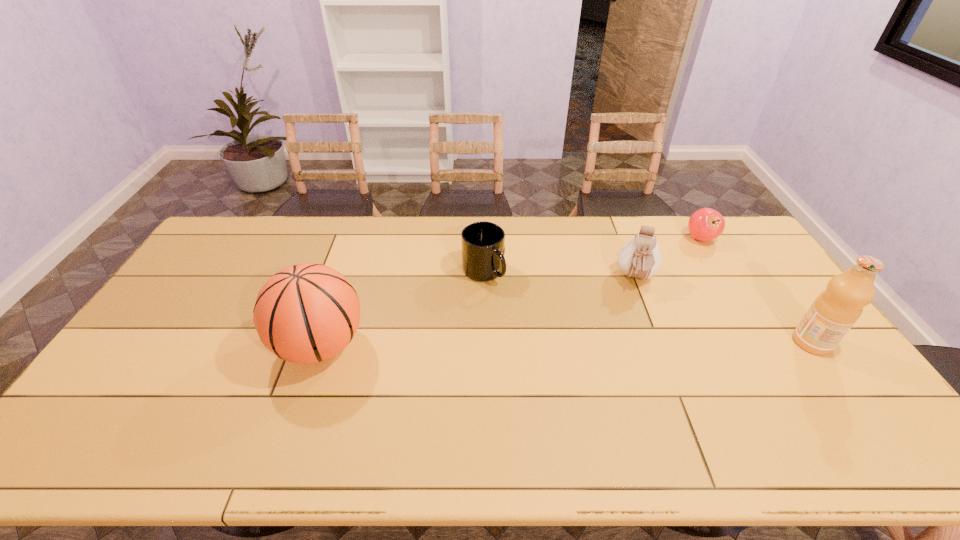
Locate an element on the screen. The height and width of the screenshot is (540, 960). vacant space in between the second object from left to right and the leftmost object is located at coordinates (402, 308).

At what (x,y) coordinates should I click in order to perform the action: click on vacant region between the leftmost object and the fourth object from right to left. Please return your answer as a coordinate pair (x, y). Looking at the image, I should click on (402, 308).

I want to click on empty space between the third tallest object and the second shortest object, so click(560, 274).

Locate an element on the screen. Image resolution: width=960 pixels, height=540 pixels. free space between the apple and the fruit juice is located at coordinates (756, 290).

At what (x,y) coordinates should I click in order to perform the action: click on free space between the fruit juice and the second shortest object. Please return your answer as a coordinate pair (x, y). The width and height of the screenshot is (960, 540). Looking at the image, I should click on (647, 307).

At what (x,y) coordinates should I click in order to perform the action: click on free space between the pouch and the leftmost object. Please return your answer as a coordinate pair (x, y). The height and width of the screenshot is (540, 960). Looking at the image, I should click on (478, 311).

Identify which object is the third nearest to the rightmost object. Please provide its 2D coordinates. Your answer should be formatted as a tuple, i.e. [(x, y)], where the tuple contains the x and y coordinates of a point satisfying the conditions above.

[(483, 243)]

Select which object is the third closest to the pouch. Please provide its 2D coordinates. Your answer should be formatted as a tuple, i.e. [(x, y)], where the tuple contains the x and y coordinates of a point satisfying the conditions above.

[(483, 243)]

Locate an element on the screen. free space in the image that satisfies the following two spatial constraints: 1. on the front side of the rightmost object; 2. on the front label of the fourth object from left to right is located at coordinates (764, 342).

This screenshot has height=540, width=960. In order to click on free location that satisfies the following two spatial constraints: 1. on the back side of the leftmost object; 2. on the front label of the fruit juice in this screenshot , I will do `click(322, 342)`.